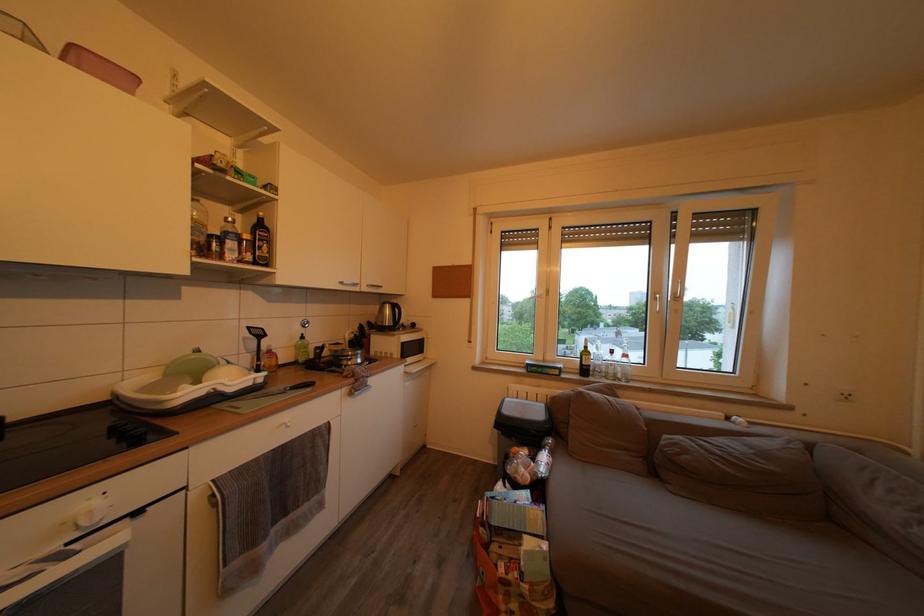
Locate an element on the screen. This screenshot has height=616, width=924. green dispenser pump is located at coordinates (301, 344).